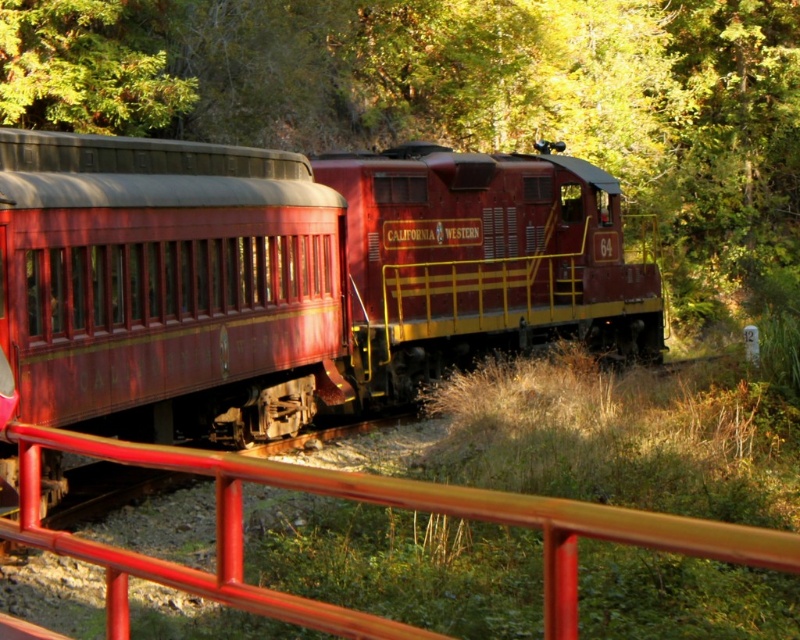
Between metallic red train at center and metallic red rail at center, which one has more height?

With more height is metallic red train at center.

Looking at this image, does metallic red train at center lie in front of metallic red rail at center?

No, metallic red train at center is behind metallic red rail at center.

Which is behind, point (376, 323) or point (536, 518)?

The point (376, 323) is more distant.

You are a GUI agent. You are given a task and a screenshot of the screen. Output one action in this format:
    pyautogui.click(x=<x>, y=<y>)
    Task: Click on the metallic red train at center
    The image size is (800, 640).
    Given the screenshot: What is the action you would take?
    click(292, 276)

Does metallic red rail at center lie behind green leafy tree at upper left?

No.

Who is positioned more to the right, metallic red rail at center or green leafy tree at upper left?

metallic red rail at center is more to the right.

Does point (486, 509) lie behind point (144, 67)?

That is False.

The height and width of the screenshot is (640, 800). What are the coordinates of `metallic red rail at center` in the screenshot? It's located at (364, 500).

Which is above, metallic red train at center or green leafy tree at upper left?

green leafy tree at upper left is above.

Is metallic red train at center positioned before green leafy tree at upper left?

Yes, it is.

Image resolution: width=800 pixels, height=640 pixels. What do you see at coordinates (292, 276) in the screenshot?
I see `metallic red train at center` at bounding box center [292, 276].

Where is `metallic red train at center`? The width and height of the screenshot is (800, 640). metallic red train at center is located at coordinates (x=292, y=276).